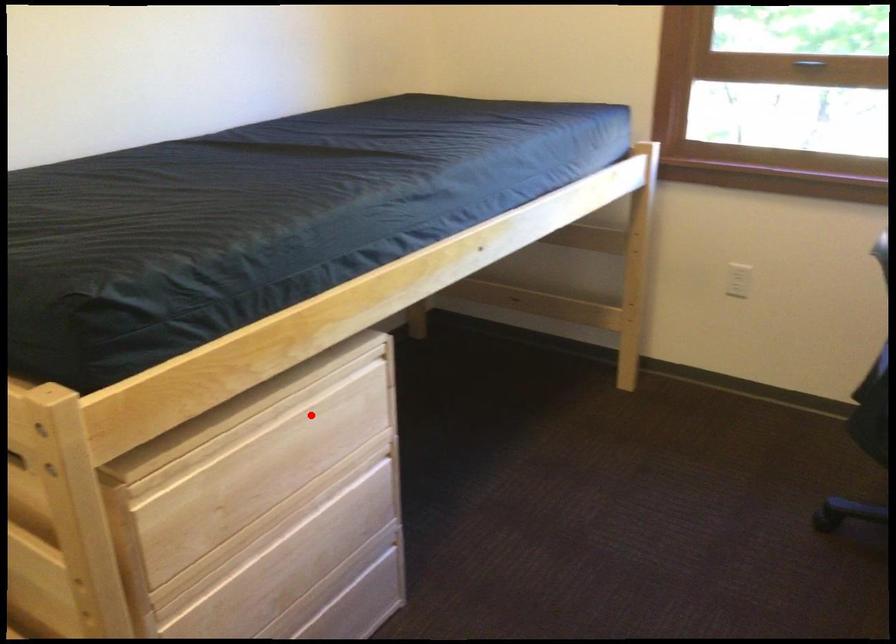
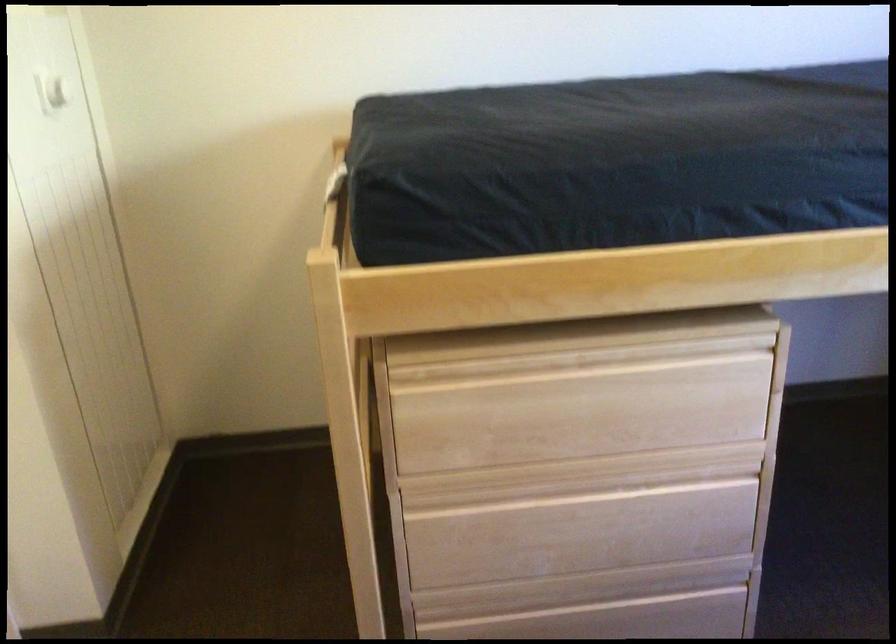
In the second image, find the point that corresponds to the highlighted location in the first image.

(642, 377)